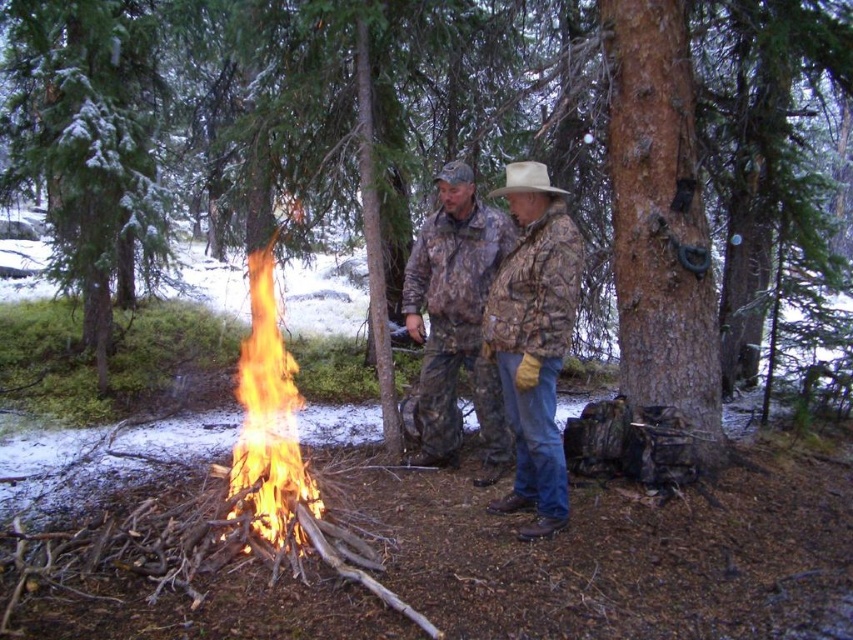
Question: Which of these objects is positioned closest to the flameflame-likefire at left?

Choices:
 (A) brown rough tree at center
 (B) camouflage jacket at center

Answer: (A)

Question: Among these points, which one is nearest to the camera?

Choices:
 (A) (482, 333)
 (B) (64, 106)
 (C) (250, 465)
 (D) (206, 22)

Answer: (A)

Question: Among these points, which one is nearest to the camera?

Choices:
 (A) (511, 161)
 (B) (61, 248)
 (C) (305, 145)

Answer: (C)

Question: Is flameflame-likefire at left bigger than white matte cowboy hat at center?

Choices:
 (A) yes
 (B) no

Answer: (B)

Question: Is brown rough tree at center bigger than camouflage jacket at center?

Choices:
 (A) no
 (B) yes

Answer: (B)

Question: Can you confirm if green textured pine tree at center is thinner than flameflame-likefire at left?

Choices:
 (A) yes
 (B) no

Answer: (B)